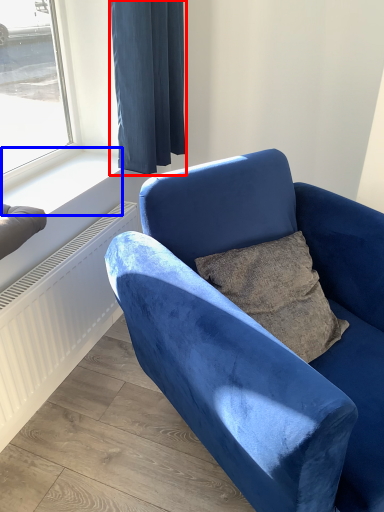
Question: Which object appears closest to the camera in this image, curtain (highlighted by a red box) or window sill (highlighted by a blue box)?

Choices:
 (A) curtain
 (B) window sill

Answer: (A)